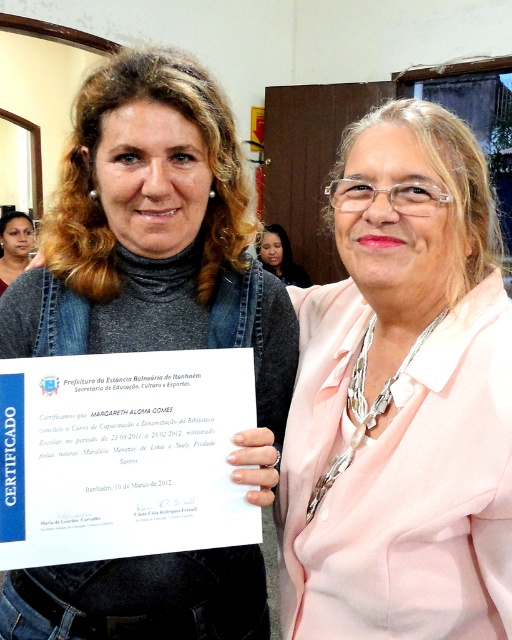
Between matte gray turtleneck sweater at center and matte black hair at center, which one has less height?

With less height is matte black hair at center.

Between point (104, 172) and point (276, 260), which one is positioned behind?

The point (276, 260) is behind.

Is point (256, 621) behind point (275, 234)?

No, (256, 621) is closer to viewer.

This screenshot has width=512, height=640. I want to click on matte gray turtleneck sweater at center, so click(158, 243).

How much distance is there between matte gray turtleneck sweater at center and matte black hair at left?

The distance of matte gray turtleneck sweater at center from matte black hair at left is 9.78 feet.

Does matte gray turtleneck sweater at center have a greater height compared to matte black hair at left?

Indeed, matte gray turtleneck sweater at center has a greater height compared to matte black hair at left.

Between point (262, 273) and point (1, 237), which one is positioned behind?

Positioned behind is point (1, 237).

At what (x,y) coordinates should I click in order to perform the action: click on matte gray turtleneck sweater at center. Please return your answer as a coordinate pair (x, y). This screenshot has height=640, width=512. Looking at the image, I should click on (158, 243).

Image resolution: width=512 pixels, height=640 pixels. Describe the element at coordinates (13, 244) in the screenshot. I see `matte black hair at left` at that location.

The width and height of the screenshot is (512, 640). Identify the location of matte black hair at left. (13, 244).

This screenshot has height=640, width=512. What are the coordinates of `matte black hair at left` in the screenshot? It's located at (13, 244).